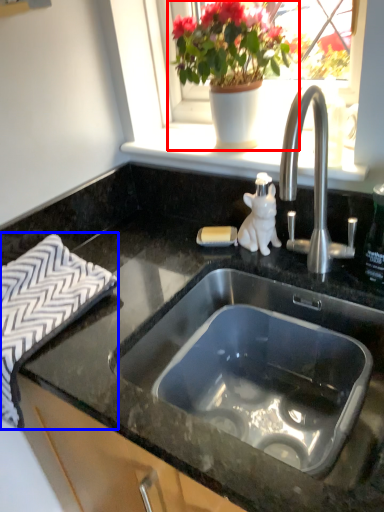
Question: Which object appears closest to the camera in this image, houseplant (highlighted by a red box) or bath towel (highlighted by a blue box)?

Choices:
 (A) houseplant
 (B) bath towel

Answer: (B)